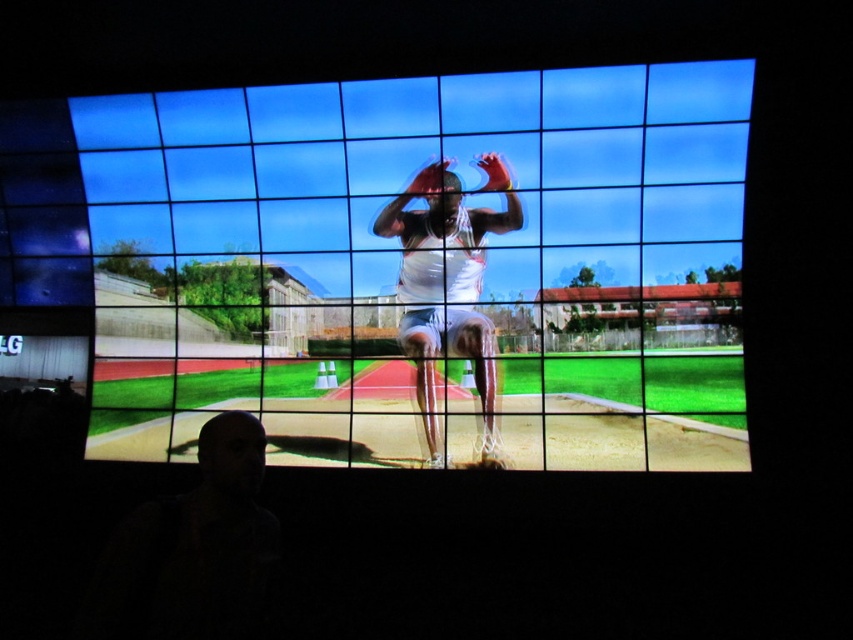
Question: Is smooth white track at center above white matte athletic uniform at center?

Choices:
 (A) yes
 (B) no

Answer: (A)

Question: Which object is farther from the camera taking this photo?

Choices:
 (A) white matte athletic uniform at center
 (B) smooth white track at center

Answer: (A)

Question: Does smooth white track at center have a lesser width compared to white matte athletic uniform at center?

Choices:
 (A) yes
 (B) no

Answer: (B)

Question: Which point is closer to the camera taking this photo?

Choices:
 (A) (432, 465)
 (B) (561, 134)

Answer: (B)

Question: Is smooth white track at center positioned before white matte athletic uniform at center?

Choices:
 (A) no
 (B) yes

Answer: (B)